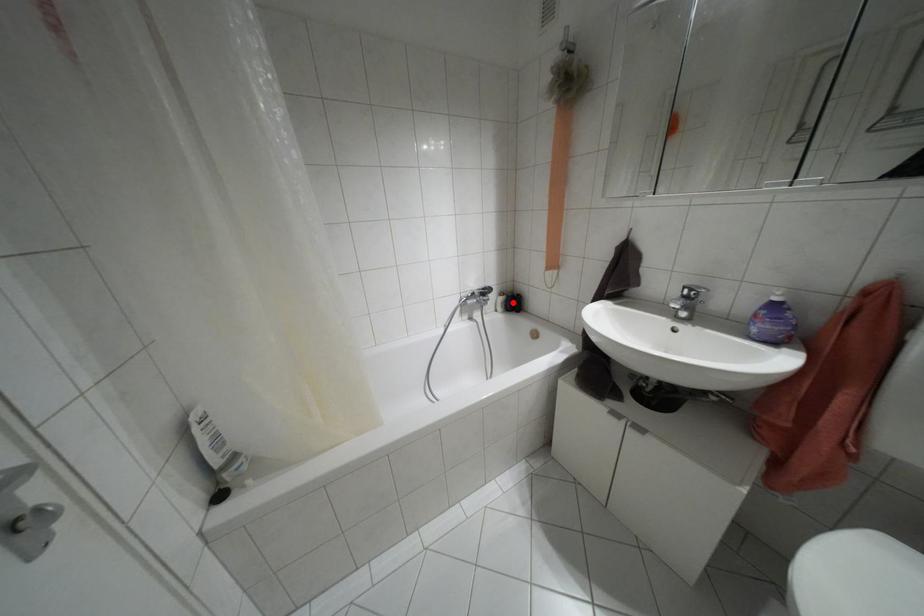
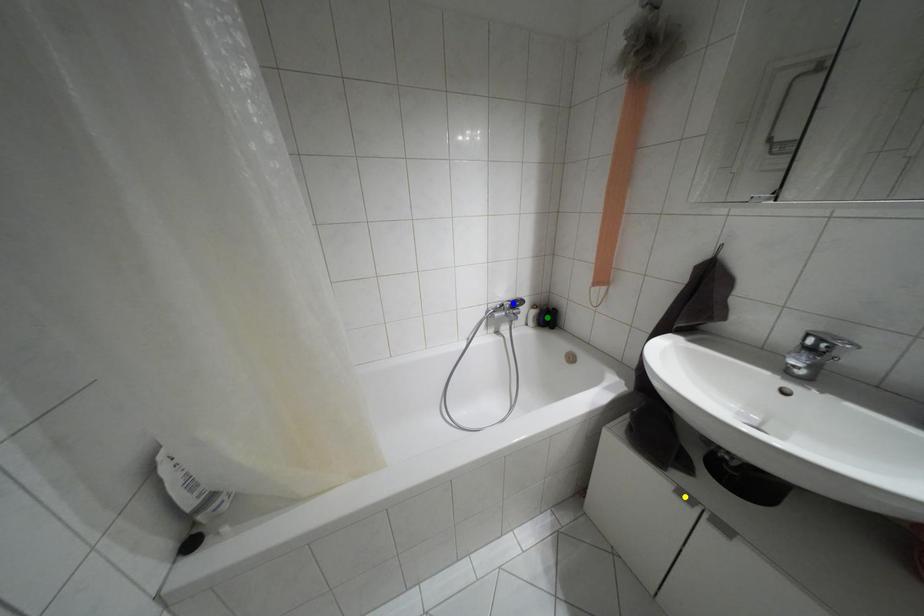
Question: I am providing you with two images of the same scene from different viewpoints. A red point is marked on the first image. You are given multiple points on the second image. Which point in image 2 is actually the same real-world point as the red point in image 1?

Choices:
 (A) yellow point
 (B) blue point
 (C) green point

Answer: (C)